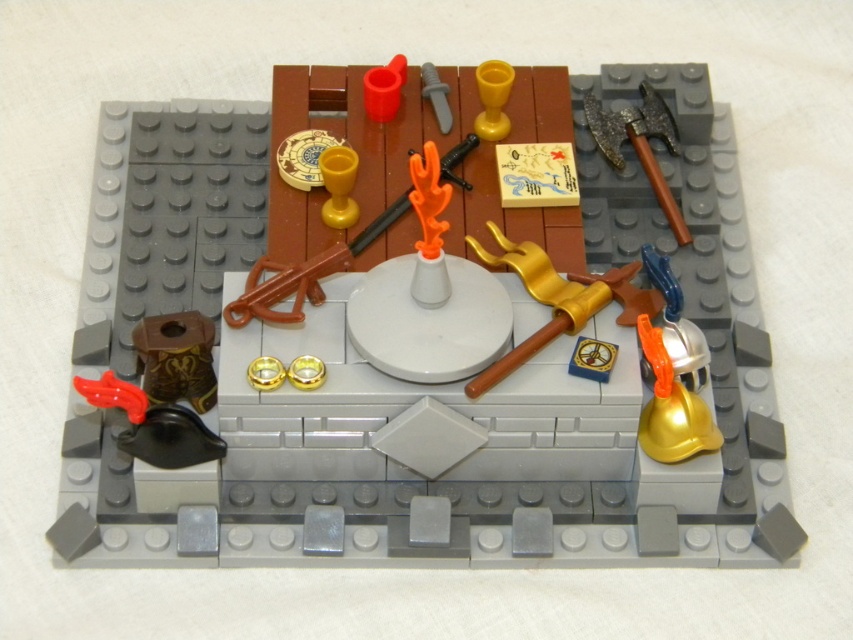
You are a medieval knight standing at the edge of the Lego scene. You see the smooth brown cup at upper center and the orange plastic torch at center. Which object is nearer to you?

The smooth brown cup at upper center is closer to the viewer than the orange plastic torch at center, so the smooth brown cup at upper center is nearer to you.

You are a medieval knight standing in the Lego scene. You see the orange plastic torch at center and the dark brown wood axe at upper right. Which object is closer to the top edge of the Lego baseplate?

The dark brown wood axe at upper right is closer to the top edge of the Lego baseplate because it is positioned above the orange plastic torch at center.